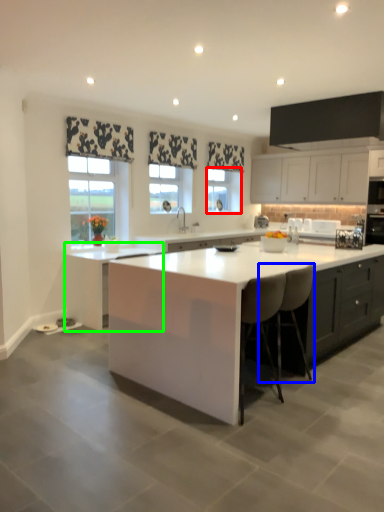
Question: Which is farther away from window (highlighted by a red box)? chair (highlighted by a blue box) or cabinetry (highlighted by a green box)?

Choices:
 (A) chair
 (B) cabinetry

Answer: (A)